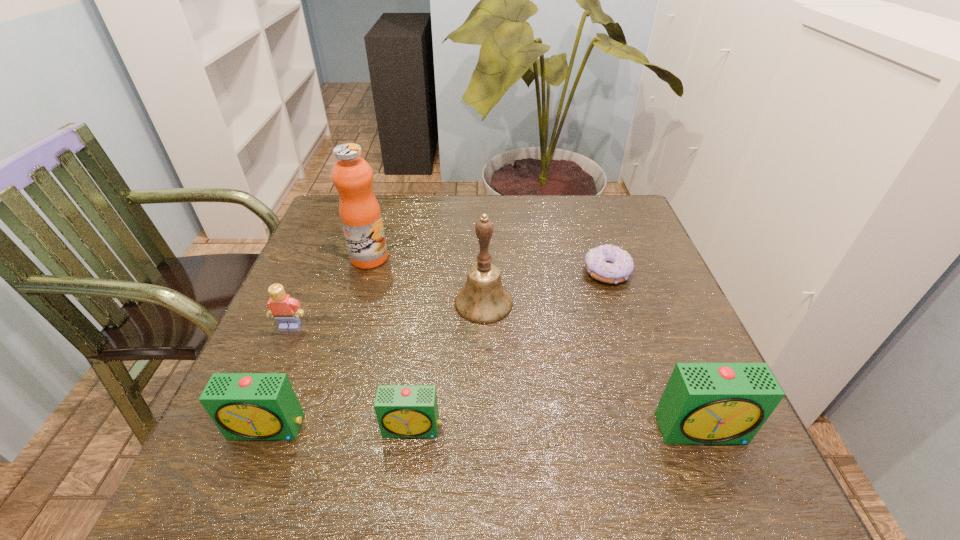
Image resolution: width=960 pixels, height=540 pixels. What are the coordinates of `free space between the tallest object and the third object from right to left` in the screenshot? It's located at (426, 280).

Where is `free spot between the fruit juice and the Lego`? The width and height of the screenshot is (960, 540). free spot between the fruit juice and the Lego is located at coordinates coord(330,293).

What are the coordinates of `vacant space that's between the fruit juice and the fifth shortest object` in the screenshot? It's located at (536, 343).

Identify the location of vacant area that lies between the second shortest object and the doughnut. The width and height of the screenshot is (960, 540). [510, 350].

Locate which object ranks fifth in proximity to the shortest object. Please provide its 2D coordinates. Your answer should be formatted as a tuple, i.e. [(x, y)], where the tuple contains the x and y coordinates of a point satisfying the conditions above.

[(286, 310)]

Locate which object ranks sixth in proximity to the doughnut. Please provide its 2D coordinates. Your answer should be formatted as a tuple, i.e. [(x, y)], where the tuple contains the x and y coordinates of a point satisfying the conditions above.

[(244, 406)]

Select which alarm clock appears as the second closest to the leftmost alarm clock. Please provide its 2D coordinates. Your answer should be formatted as a tuple, i.e. [(x, y)], where the tuple contains the x and y coordinates of a point satisfying the conditions above.

[(703, 403)]

The image size is (960, 540). Find the location of `alarm clock object that ranks as the closest to the second tallest object`. alarm clock object that ranks as the closest to the second tallest object is located at coordinates (403, 411).